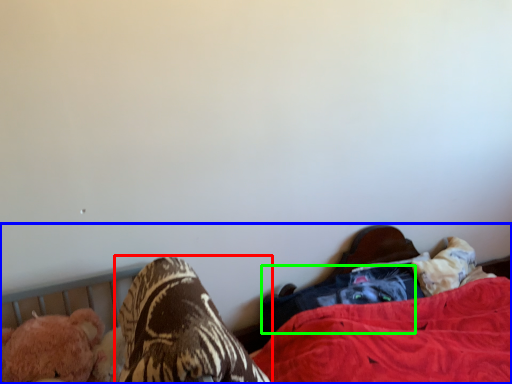
Question: Estimate the real-world distances between objects in this image. Which object is closer to footwear (highlighted by a red box), bed (highlighted by a blue box) or clothing (highlighted by a green box)?

Choices:
 (A) bed
 (B) clothing

Answer: (B)